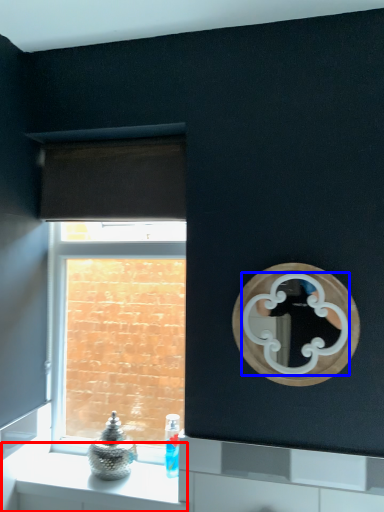
Question: Which object appears closest to the camera in this image, counter (highlighted by a red box) or mirror (highlighted by a blue box)?

Choices:
 (A) counter
 (B) mirror

Answer: (B)